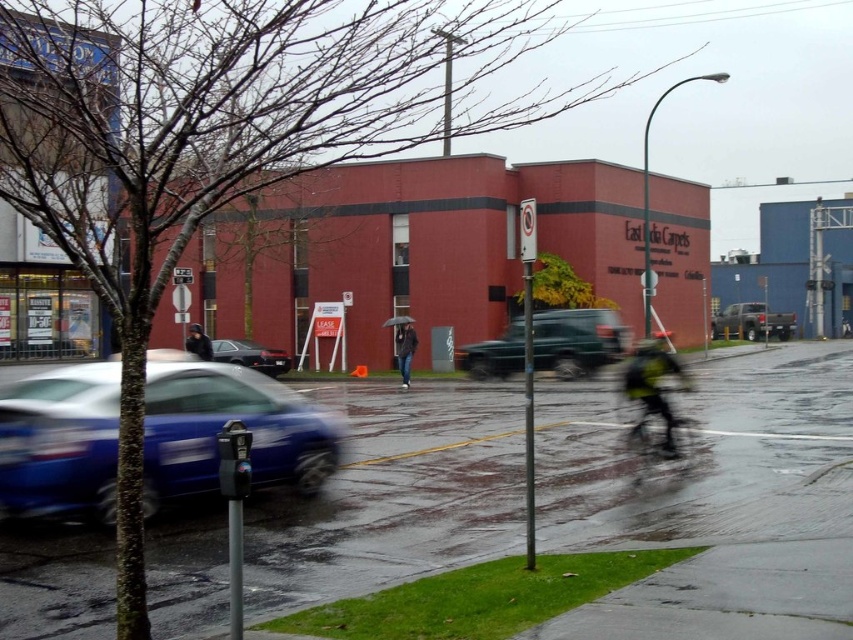
Question: Can you confirm if metallic blue sedan at lower left is thinner than dark gray jacket at center?

Choices:
 (A) yes
 (B) no

Answer: (B)

Question: Considering the real-world distances, which object is closest to the metallic blue sedan at lower left?

Choices:
 (A) dark gray jacket at center
 (B) shiny black sedan at center

Answer: (A)

Question: Among these objects, which one is farthest from the camera?

Choices:
 (A) green matte suv at center
 (B) matte green truck at right
 (C) shiny black sedan at center
 (D) dark gray jacket at center

Answer: (B)

Question: Is metallic blue sedan at lower left wider than dark blue jeans at center?

Choices:
 (A) no
 (B) yes

Answer: (B)

Question: Considering the relative positions of green matte suv at center and matte green truck at right in the image provided, where is green matte suv at center located with respect to matte green truck at right?

Choices:
 (A) above
 (B) below

Answer: (B)

Question: Which of these objects is positioned farthest from the metallic blue sedan at lower left?

Choices:
 (A) yellow-green reflective jacket at center-right
 (B) green matte suv at center

Answer: (B)